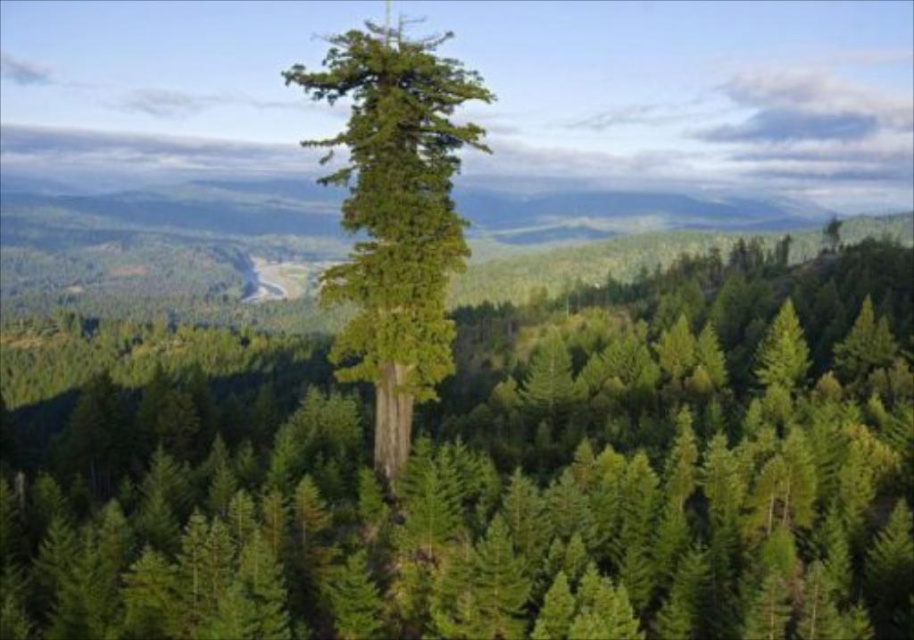
Between point (490, 566) and point (386, 374), which one is positioned behind?

Point (386, 374)

Is green textured tree at center to the right of green rough bark tree at center from the viewer's perspective?

Indeed, green textured tree at center is positioned on the right side of green rough bark tree at center.

Is point (186, 333) more distant than point (344, 38)?

Yes, it is.

Where is `green textured tree at center`? green textured tree at center is located at coordinates (482, 468).